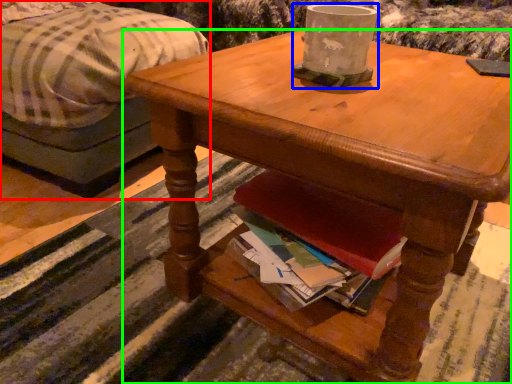
Question: Which object is positioned farthest from studio couch (highlighted by a red box)? Select from coffee cup (highlighted by a blue box) and desk (highlighted by a green box).

Choices:
 (A) coffee cup
 (B) desk

Answer: (A)